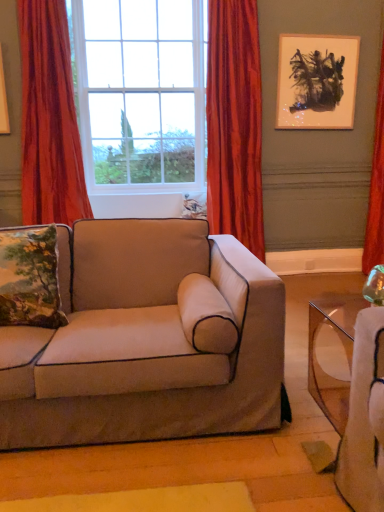
Question: Considering the relative positions of velvet-like red curtain at center, which is the 2th curtain from right to left, and suede beige couch at center in the image provided, is velvet-like red curtain at center, which is the 2th curtain from right to left, to the right of suede beige couch at center from the viewer's perspective?

Choices:
 (A) no
 (B) yes

Answer: (B)

Question: Is velvet-like red curtain at center, which is the 2th curtain from right to left, touching suede beige couch at center?

Choices:
 (A) yes
 (B) no

Answer: (B)

Question: From the image's perspective, is velvet-like red curtain at center, which is the 2th curtain from right to left, over suede beige couch at center?

Choices:
 (A) yes
 (B) no

Answer: (A)

Question: Is velvet-like red curtain at center, positioned as the second curtain in left-to-right order, facing away from suede beige couch at center?

Choices:
 (A) yes
 (B) no

Answer: (B)

Question: Are velvet-like red curtain at center, which is the 2th curtain from right to left, and suede beige couch at center far apart?

Choices:
 (A) yes
 (B) no

Answer: (A)

Question: Based on their sizes in the image, would you say clear glass window at center is bigger or smaller than suede beige couch at center?

Choices:
 (A) small
 (B) big

Answer: (B)

Question: Is clear glass window at center inside the boundaries of suede beige couch at center, or outside?

Choices:
 (A) inside
 (B) outside

Answer: (B)

Question: Considering their positions, is clear glass window at center located in front of or behind suede beige couch at center?

Choices:
 (A) front
 (B) behind

Answer: (B)

Question: From the image's perspective, is clear glass window at center positioned above or below suede beige couch at center?

Choices:
 (A) above
 (B) below

Answer: (A)

Question: Does point (352, 90) appear closer or farther from the camera than point (382, 238)?

Choices:
 (A) farther
 (B) closer

Answer: (B)

Question: From a real-world perspective, is matte black painting at upper right above or below red velvet curtain at right, the third curtain positioned from the left?

Choices:
 (A) below
 (B) above

Answer: (B)

Question: Looking at their shapes, would you say matte black painting at upper right is wider or thinner than red velvet curtain at right, which ranks as the 1th curtain in right-to-left order?

Choices:
 (A) thin
 (B) wide

Answer: (A)

Question: Relative to red velvet curtain at right, which ranks as the 1th curtain in right-to-left order, is matte black painting at upper right in front or behind?

Choices:
 (A) front
 (B) behind

Answer: (B)

Question: From the image's perspective, is suede beige couch at center positioned above or below clear glass window at center?

Choices:
 (A) above
 (B) below

Answer: (B)

Question: Is point (263, 274) closer or farther from the camera than point (165, 5)?

Choices:
 (A) closer
 (B) farther

Answer: (A)